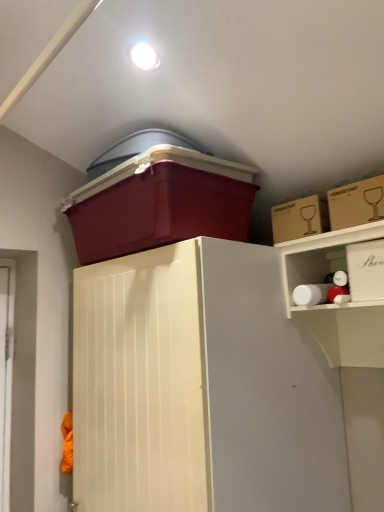
Question: Considering the relative positions of matte plastic storage box at upper center, the fourth storage box when ordered from right to left, and cardboard box at upper right, marked as the second storage box in a left-to-right arrangement, in the image provided, is matte plastic storage box at upper center, the fourth storage box when ordered from right to left, to the left or to the right of cardboard box at upper right, marked as the second storage box in a left-to-right arrangement,?

Choices:
 (A) left
 (B) right

Answer: (A)

Question: From a real-world perspective, is matte plastic storage box at upper center, the fourth storage box when ordered from right to left, physically located above or below cardboard box at upper right, which ranks as the third storage box in right-to-left order?

Choices:
 (A) above
 (B) below

Answer: (A)

Question: Based on their relative distances, which object is nearer to the cardboard box at upper right, marked as the second storage box in a left-to-right arrangement?

Choices:
 (A) white cardboard box at upper right, which ranks as the 4th storage box in left-to-right order
 (B) matte plastic storage box at upper center, arranged as the first storage box when viewed from the left
 (C) cardboard box at upper right, which is counted as the 3th storage box, starting from the left

Answer: (C)

Question: Estimate the real-world distances between objects in this image. Which object is farther from the cardboard box at upper right, which is counted as the 3th storage box, starting from the left?

Choices:
 (A) cardboard box at upper right, marked as the second storage box in a left-to-right arrangement
 (B) white cardboard box at upper right, the 1th storage box from the right
 (C) matte plastic storage box at upper center, arranged as the first storage box when viewed from the left

Answer: (C)